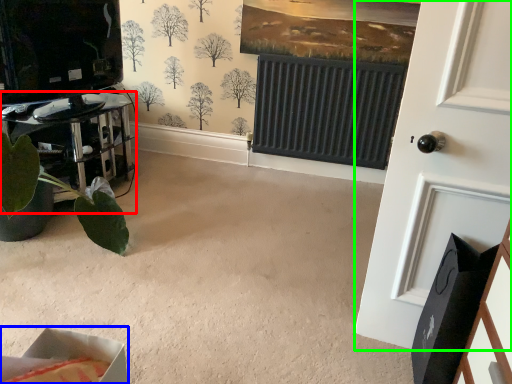
Question: Which object is positioned closest to furniture (highlighted by a red box)? Select from cardboard box (highlighted by a blue box) and door (highlighted by a green box).

Choices:
 (A) cardboard box
 (B) door

Answer: (B)